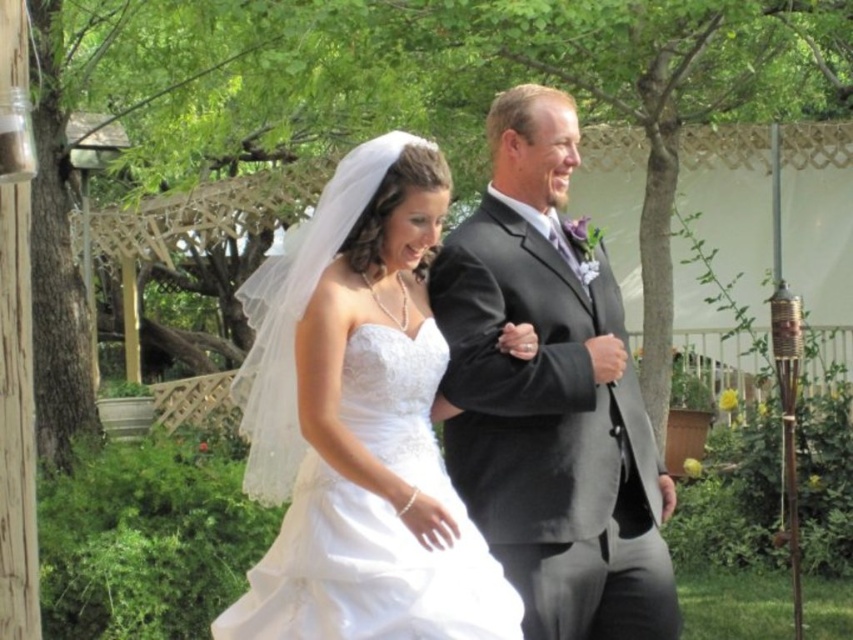
Question: Does white satin dress at center lie in front of matte black suit at center?

Choices:
 (A) no
 (B) yes

Answer: (B)

Question: Observing the image, what is the correct spatial positioning of white satin dress at center in reference to matte black suit at center?

Choices:
 (A) left
 (B) right

Answer: (A)

Question: Considering the relative positions of white satin dress at center and matte black suit at center in the image provided, where is white satin dress at center located with respect to matte black suit at center?

Choices:
 (A) below
 (B) above

Answer: (A)

Question: Among these objects, which one is farthest from the camera?

Choices:
 (A) white satin dress at center
 (B) matte black suit at center

Answer: (B)

Question: Which of the following is the closest to the observer?

Choices:
 (A) (308, 577)
 (B) (639, 424)

Answer: (A)